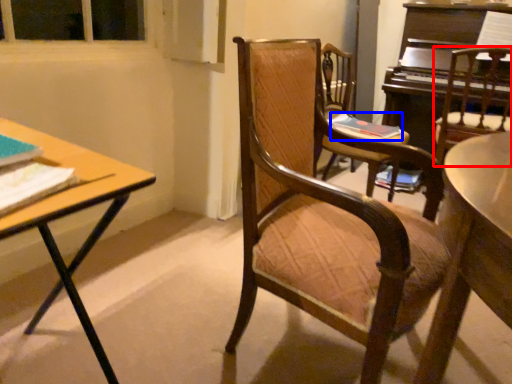
Question: Which point is closer to the camera, chair (highlighted by a red box) or book (highlighted by a blue box)?

Choices:
 (A) chair
 (B) book

Answer: (A)